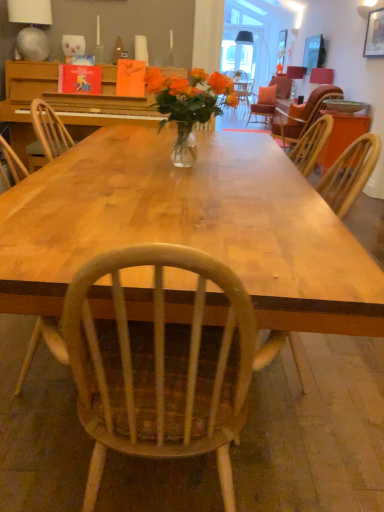
Question: From a real-world perspective, is orange paper card at center, which ranks as the 1th book in right-to-left order, over translucent glass vase at center?

Choices:
 (A) yes
 (B) no

Answer: (A)

Question: Is orange paper card at center, which appears as the 2th book when viewed from the left, shorter than translucent glass vase at center?

Choices:
 (A) no
 (B) yes

Answer: (B)

Question: Is translucent glass vase at center at the back of orange paper card at center, which ranks as the 1th book in right-to-left order?

Choices:
 (A) yes
 (B) no

Answer: (B)

Question: Is orange paper card at center, which appears as the 2th book when viewed from the left, outside translucent glass vase at center?

Choices:
 (A) no
 (B) yes

Answer: (B)

Question: Does orange paper card at center, which appears as the 2th book when viewed from the left, contain translucent glass vase at center?

Choices:
 (A) no
 (B) yes

Answer: (A)

Question: From the image's perspective, does orange paper card at center, which ranks as the 1th book in right-to-left order, appear lower than translucent glass vase at center?

Choices:
 (A) yes
 (B) no

Answer: (B)

Question: From the image's perspective, is matte wooden frame at upper right on shiny wood table at center?

Choices:
 (A) yes
 (B) no

Answer: (A)

Question: Is matte wooden frame at upper right thinner than shiny wood table at center?

Choices:
 (A) yes
 (B) no

Answer: (A)

Question: Is matte wooden frame at upper right smaller than shiny wood table at center?

Choices:
 (A) no
 (B) yes

Answer: (B)

Question: From the image's perspective, is matte wooden frame at upper right below shiny wood table at center?

Choices:
 (A) yes
 (B) no

Answer: (B)

Question: Is matte wooden frame at upper right at the right side of shiny wood table at center?

Choices:
 (A) yes
 (B) no

Answer: (A)

Question: Is matte wooden frame at upper right positioned before shiny wood table at center?

Choices:
 (A) no
 (B) yes

Answer: (A)

Question: Could you tell me if matte pink lampshade at upper right, which is the second lamp in bottom-to-top order, is facing wooden table at right?

Choices:
 (A) yes
 (B) no

Answer: (B)